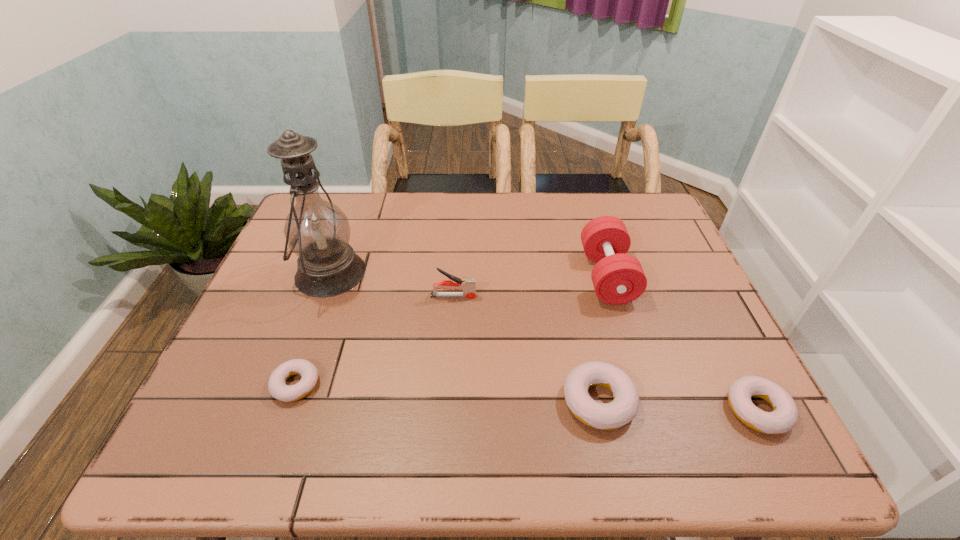
Where is `vacant position for inserting another doughnut evenly`? The height and width of the screenshot is (540, 960). vacant position for inserting another doughnut evenly is located at coordinates (444, 393).